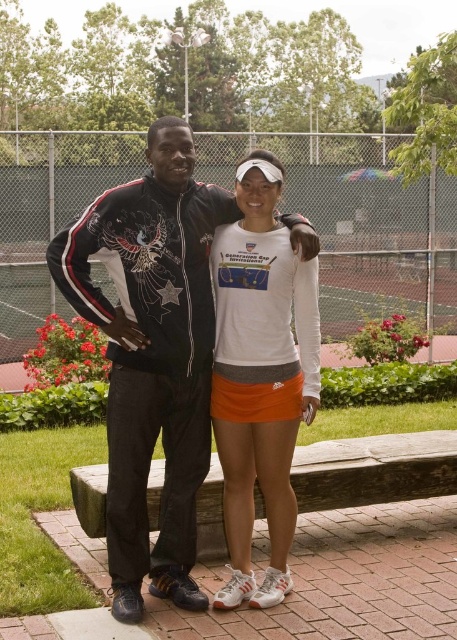
Which is below, matte black jacket at center or white matte tennis skirt at center?

white matte tennis skirt at center is below.

Is matte black jacket at center further to camera compared to white matte tennis skirt at center?

No, matte black jacket at center is in front of white matte tennis skirt at center.

This screenshot has height=640, width=457. What do you see at coordinates (152, 355) in the screenshot?
I see `matte black jacket at center` at bounding box center [152, 355].

Where is `matte black jacket at center`? matte black jacket at center is located at coordinates (152, 355).